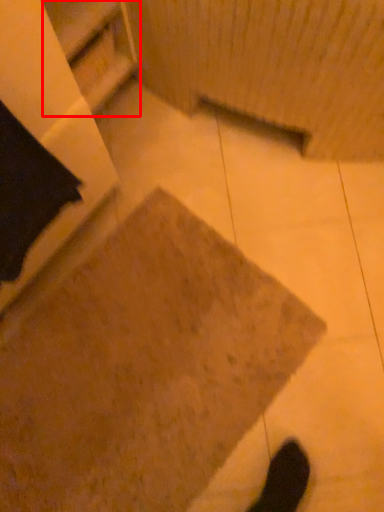
Question: From the image's perspective, where is shelf (annotated by the red box) located relative to concrete?

Choices:
 (A) below
 (B) above

Answer: (B)